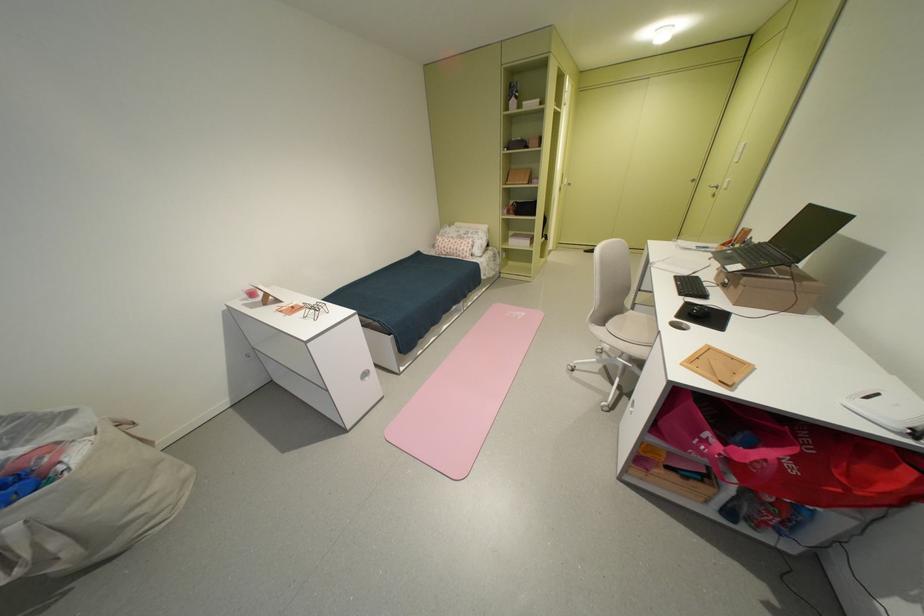
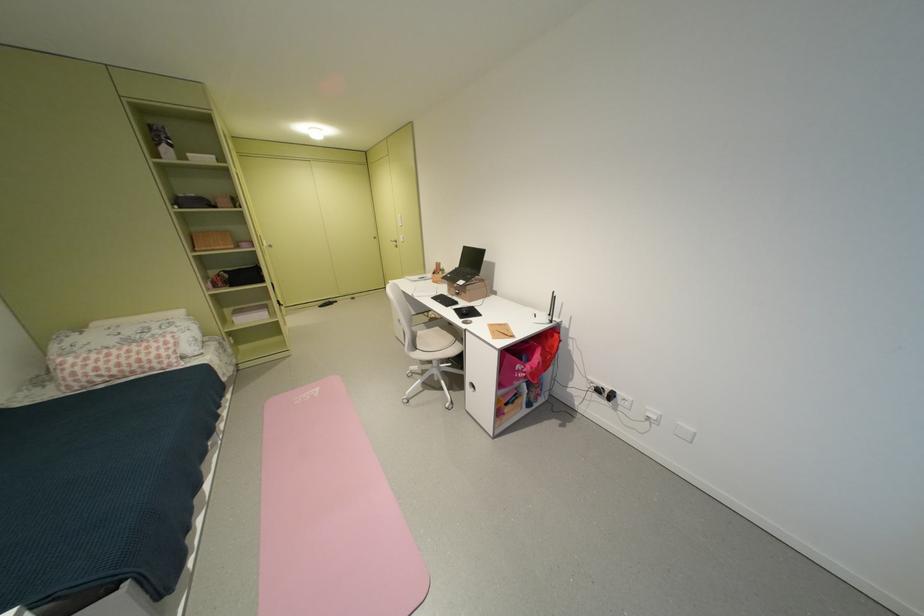
Locate, in the second image, the point that corresponds to point (468, 252) in the first image.

(159, 362)